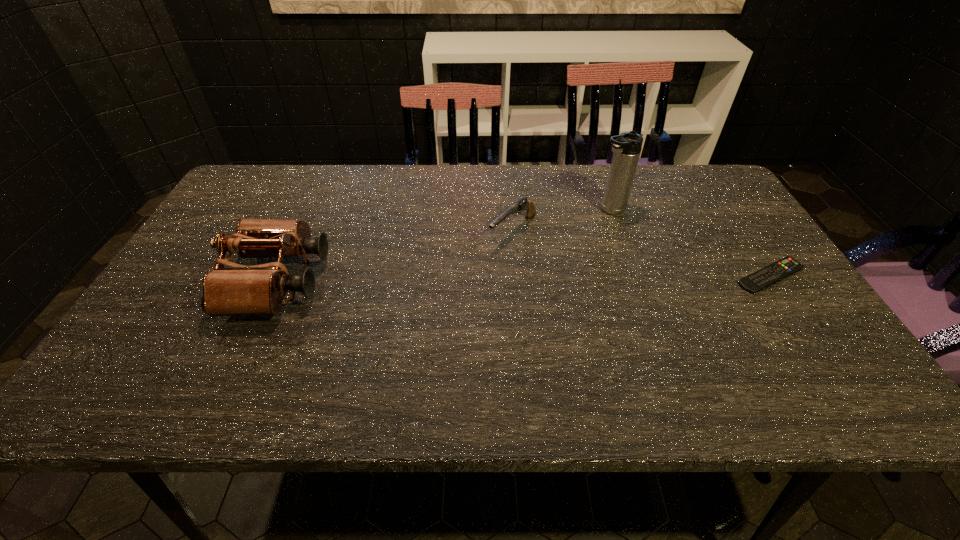
Locate an element on the screen. vacant area located 0.260m on the handle side of the thermos bottle is located at coordinates (529, 252).

Identify the location of vacant area situated 0.120m on the handle side of the thermos bottle. Image resolution: width=960 pixels, height=540 pixels. (567, 232).

Identify the location of vacant space situated 0.290m on the handle side of the thermos bottle. (520, 256).

At what (x,y) coordinates should I click in order to perform the action: click on free space located aiming along the barrel of the gun. Please return your answer as a coordinate pair (x, y). Looking at the image, I should click on (391, 346).

Find the location of a particular element. free location located 0.190m aiming along the barrel of the gun is located at coordinates (453, 289).

The image size is (960, 540). Find the location of `vacant area located aiming along the barrel of the gun`. vacant area located aiming along the barrel of the gun is located at coordinates (458, 285).

Find the location of a particular element. object that is at the far edge is located at coordinates (627, 146).

Find the location of a particular element. The height and width of the screenshot is (540, 960). object present at the left edge is located at coordinates (257, 290).

Locate an element on the screen. object at the right edge is located at coordinates (779, 270).

Find the location of a particular element. The width and height of the screenshot is (960, 540). vacant space at the far edge is located at coordinates (489, 177).